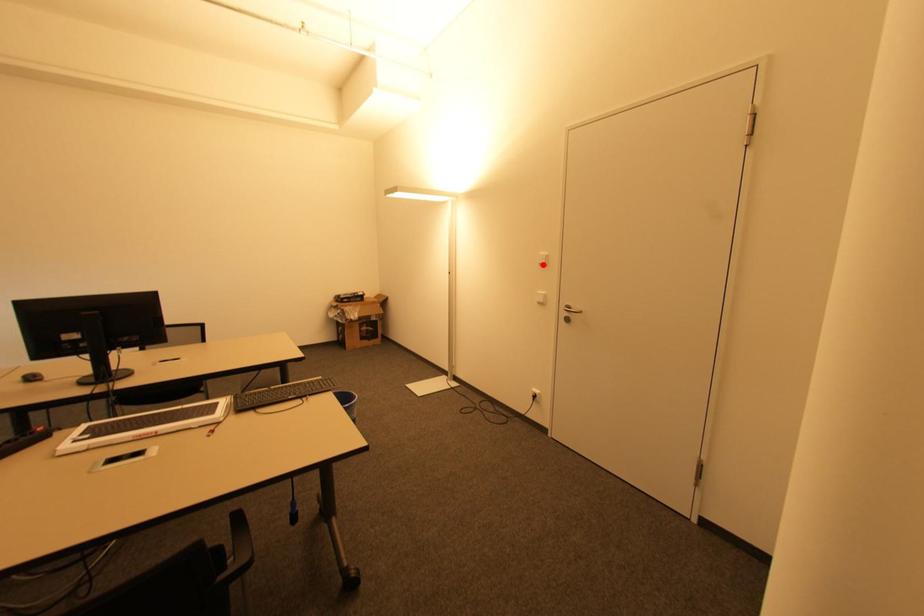
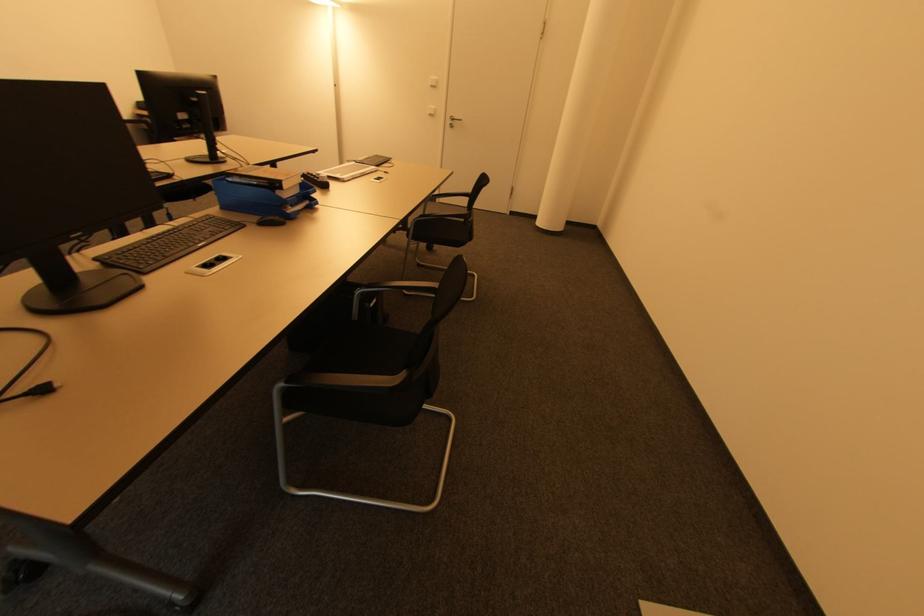
The point at the highlighted location is marked in the first image. Where is the corresponding point in the second image?

(434, 87)